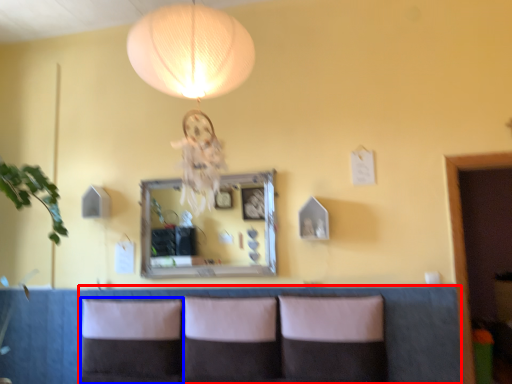
Question: Which object is further to the camera taking this photo, couch (highlighted by a red box) or pillow (highlighted by a blue box)?

Choices:
 (A) couch
 (B) pillow

Answer: (B)